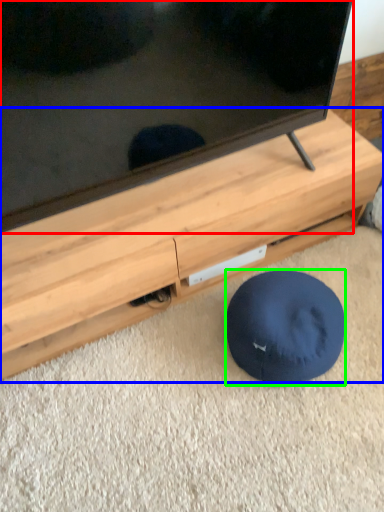
Question: Which is nearer to the television (highlighted by a red box)? furniture (highlighted by a blue box) or dog bed (highlighted by a green box).

Choices:
 (A) furniture
 (B) dog bed

Answer: (A)